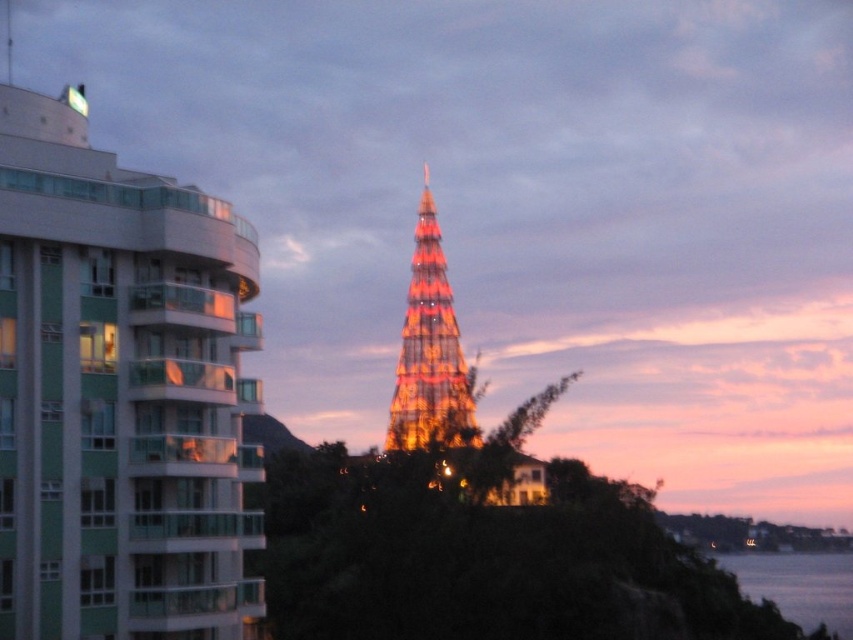
You are standing on the balcony of the apartment building on the left. You see the illuminated glass eiffel tower at center and the transparent water at lower right. Which object is taller?

The illuminated glass eiffel tower at center is taller than the transparent water at lower right.

Consider the image. You are standing on the balcony of the apartment building on the left and want to take a photo of the illuminated glass eiffel tower at center and the transparent water at lower right. Which object will appear larger in your photo?

The illuminated glass eiffel tower at center will appear larger in your photo because it is closer to you than the transparent water at lower right.

Based on the photo, you are standing at a viewpoint and want to take a photo of the white glossy building at left. If the recommended safe distance for photography is 150 feet, is the current distance sufficient?

The distance of white glossy building at left from camera is 170.30 feet, which exceeds the recommended safe distance of 150 feet. Therefore, the current distance is sufficient for taking the photo safely.